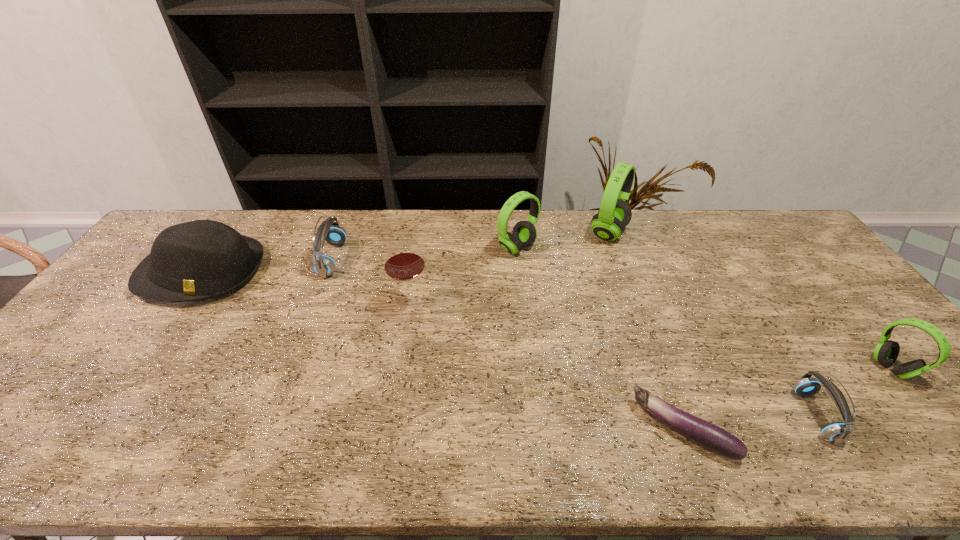
Where is `free spot located 0.350m on the back of the smallest green headset`? This screenshot has height=540, width=960. free spot located 0.350m on the back of the smallest green headset is located at coordinates (802, 262).

Locate an element on the screen. This screenshot has width=960, height=540. vacant position located 0.100m on the ear cups of the farther blue headset is located at coordinates (374, 259).

Where is `vacant space located on the ear cups of the smaller blue headset`? The image size is (960, 540). vacant space located on the ear cups of the smaller blue headset is located at coordinates (693, 415).

Locate an element on the screen. This screenshot has width=960, height=540. vacant space located 0.300m on the ear cups of the smaller blue headset is located at coordinates (671, 415).

At what (x,y) coordinates should I click in order to perform the action: click on free location located on the ear cups of the smaller blue headset. Please return your answer as a coordinate pair (x, y). Looking at the image, I should click on (640, 415).

Where is `vacant space located on the right of the eggplant`? This screenshot has height=540, width=960. vacant space located on the right of the eggplant is located at coordinates (828, 430).

This screenshot has height=540, width=960. Identify the location of fedora positioned at the far edge. (198, 260).

Find the location of a particular element. headset that is at the near edge is located at coordinates (837, 432).

At what (x,y) coordinates should I click in order to perform the action: click on eggplant at the near edge. Please return your answer as a coordinate pair (x, y). The height and width of the screenshot is (540, 960). Looking at the image, I should click on (710, 436).

This screenshot has height=540, width=960. I want to click on object situated at the left edge, so click(x=198, y=260).